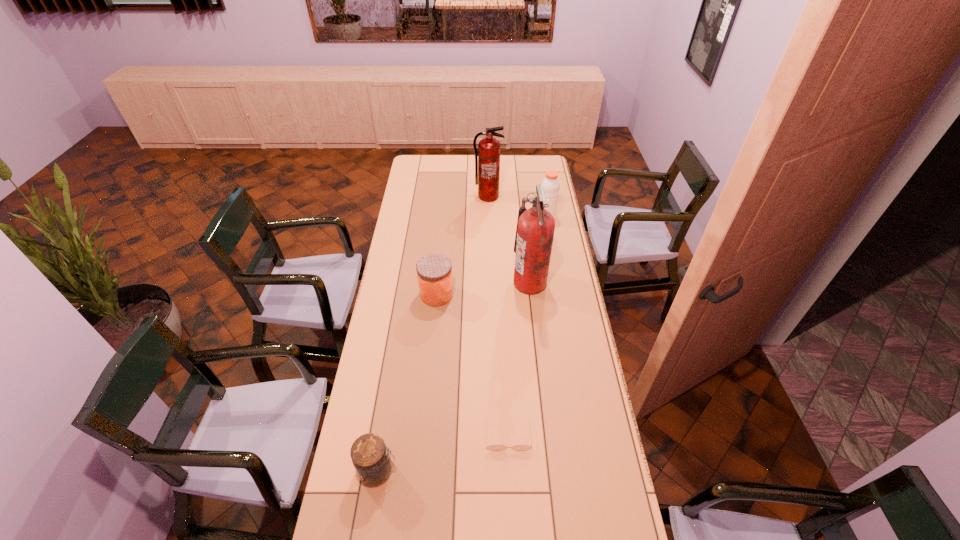
I want to click on fire extinguisher positioned at the right edge, so 535,229.

The height and width of the screenshot is (540, 960). What are the coordinates of `shaker located in the right edge section of the desktop` in the screenshot? It's located at (551, 185).

This screenshot has width=960, height=540. I want to click on vacant space at the far edge, so click(x=468, y=159).

What are the coordinates of `free space at the left edge of the desktop` in the screenshot? It's located at (396, 404).

Locate an element on the screen. The width and height of the screenshot is (960, 540). vacant space at the right edge of the desktop is located at coordinates click(553, 374).

Find the location of a particular element. The height and width of the screenshot is (540, 960). free area in between the left jar and the taller fire extinguisher is located at coordinates [454, 376].

Where is `vacant area that lies between the left fire extinguisher and the fifth farthest object`? vacant area that lies between the left fire extinguisher and the fifth farthest object is located at coordinates (498, 316).

Image resolution: width=960 pixels, height=540 pixels. Find the location of `vacant space that is in between the shortest object and the farthest object`. vacant space that is in between the shortest object and the farthest object is located at coordinates (498, 316).

At what (x,y) coordinates should I click in order to perform the action: click on vacant space in between the taller fire extinguisher and the right jar. Please return your answer as a coordinate pair (x, y). This screenshot has width=960, height=540. Looking at the image, I should click on pyautogui.click(x=483, y=289).

This screenshot has width=960, height=540. What are the coordinates of `empty space that is in between the shorter fire extinguisher and the shortest object` in the screenshot? It's located at (498, 316).